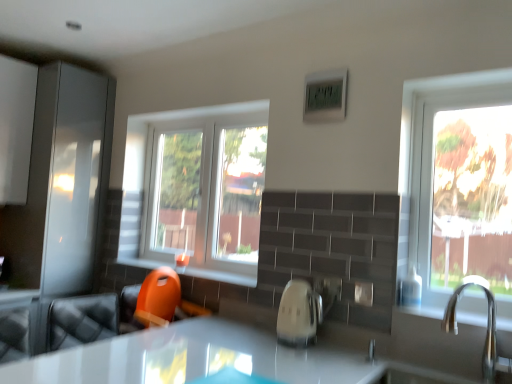
Question: Is orange plastic toy at lower center taller than white glossy kettle at center?

Choices:
 (A) no
 (B) yes

Answer: (A)

Question: Would you say orange plastic toy at lower center is a long distance from white glossy kettle at center?

Choices:
 (A) yes
 (B) no

Answer: (B)

Question: Could white glossy kettle at center be considered to be inside orange plastic toy at lower center?

Choices:
 (A) yes
 (B) no

Answer: (B)

Question: Considering the relative sizes of orange plastic toy at lower center and white glossy kettle at center in the image provided, is orange plastic toy at lower center wider than white glossy kettle at center?

Choices:
 (A) yes
 (B) no

Answer: (A)

Question: From a real-world perspective, is orange plastic toy at lower center physically below white glossy kettle at center?

Choices:
 (A) no
 (B) yes

Answer: (A)

Question: From a real-world perspective, is orange plastic toy at lower center physically above white glossy kettle at center?

Choices:
 (A) yes
 (B) no

Answer: (A)

Question: From the image's perspective, is white glossy kettle at center under clear glass window at center?

Choices:
 (A) yes
 (B) no

Answer: (A)

Question: Considering the relative sizes of white glossy kettle at center and clear glass window at center in the image provided, is white glossy kettle at center smaller than clear glass window at center?

Choices:
 (A) no
 (B) yes

Answer: (B)

Question: Is clear glass window at center located within white glossy kettle at center?

Choices:
 (A) no
 (B) yes

Answer: (A)

Question: Could you tell me if white glossy kettle at center is facing clear glass window at center?

Choices:
 (A) no
 (B) yes

Answer: (A)

Question: Does white glossy kettle at center appear on the right side of clear glass window at center?

Choices:
 (A) no
 (B) yes

Answer: (B)

Question: Is white glossy kettle at center not close to clear glass window at center?

Choices:
 (A) yes
 (B) no

Answer: (B)

Question: Does orange plastic toy at lower center have a lesser height compared to silver metallic faucet at right?

Choices:
 (A) yes
 (B) no

Answer: (A)